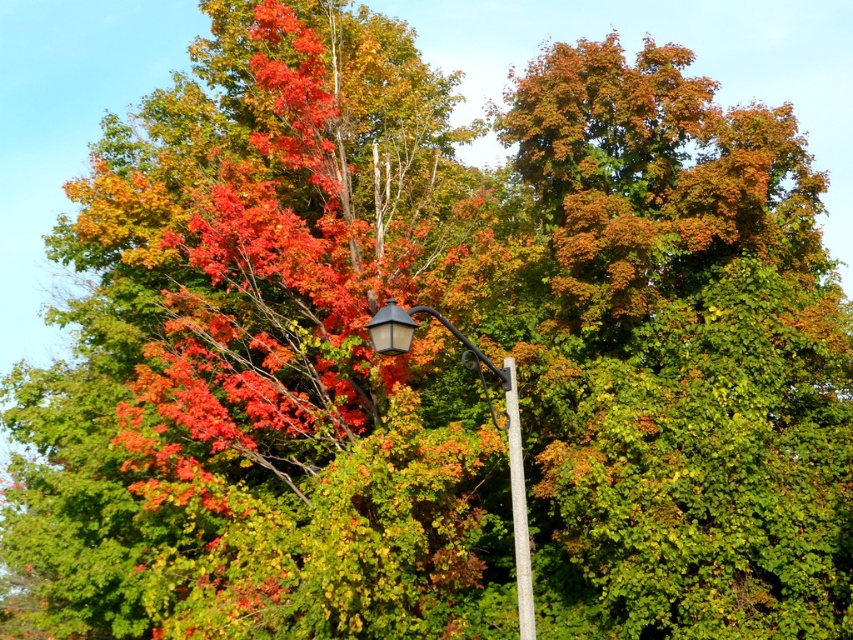
Based on the photo, you are a city planner assessing the placement of the matte black street light at center and the white smooth pole at center in this autumn scene. Considering their sizes, which object would cast a longer shadow during the day?

The matte black street light at center has a larger size compared to the white smooth pole at center, so it would cast a longer shadow during the day.

You are standing in an autumn park and see the matte black street light at center and the white smooth pole at center. Which object is located above the other?

The matte black street light at center is positioned over the white smooth pole at center.

Consider the image. You are a city planner assessing the width of the matte black street light at center and the white smooth pole at center. Based on the scene, which object is wider?

The matte black street light at center is wider than the white smooth pole at center according to the description.